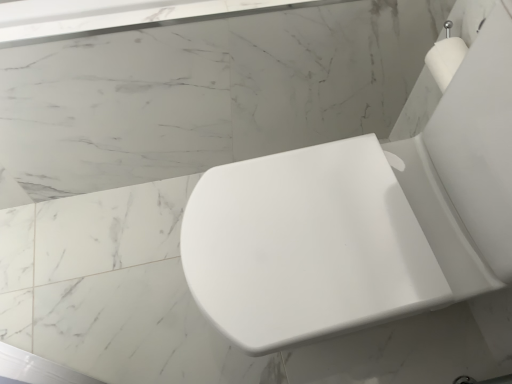
The image size is (512, 384). In order to click on vacant space to the left of white glossy toilet seat at center in this screenshot , I will do `click(122, 284)`.